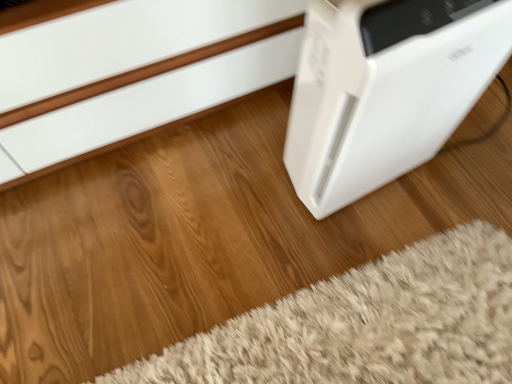
Question: Is point (334, 144) positioned closer to the camera than point (309, 309)?

Choices:
 (A) closer
 (B) farther

Answer: (A)

Question: From a real-world perspective, relative to white fluffy rug at lower right, is white plastic air purifier at right vertically above or below?

Choices:
 (A) above
 (B) below

Answer: (A)

Question: Looking at their shapes, would you say white plastic air purifier at right is wider or thinner than white fluffy rug at lower right?

Choices:
 (A) wide
 (B) thin

Answer: (B)

Question: From the image's perspective, is white fluffy rug at lower right positioned above or below white plastic air purifier at right?

Choices:
 (A) below
 (B) above

Answer: (A)

Question: From a real-world perspective, is white fluffy rug at lower right above or below white plastic air purifier at right?

Choices:
 (A) below
 (B) above

Answer: (A)

Question: From their relative heights in the image, would you say white fluffy rug at lower right is taller or shorter than white plastic air purifier at right?

Choices:
 (A) short
 (B) tall

Answer: (A)

Question: Is point pyautogui.click(x=266, y=375) positioned closer to the camera than point pyautogui.click(x=391, y=157)?

Choices:
 (A) closer
 (B) farther

Answer: (A)